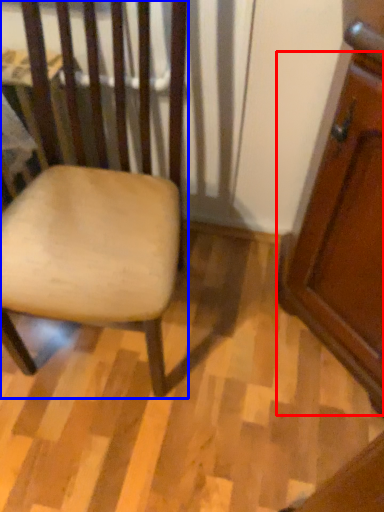
Question: Which object appears farthest to the camera in this image, screen door (highlighted by a red box) or chair (highlighted by a blue box)?

Choices:
 (A) screen door
 (B) chair

Answer: (A)